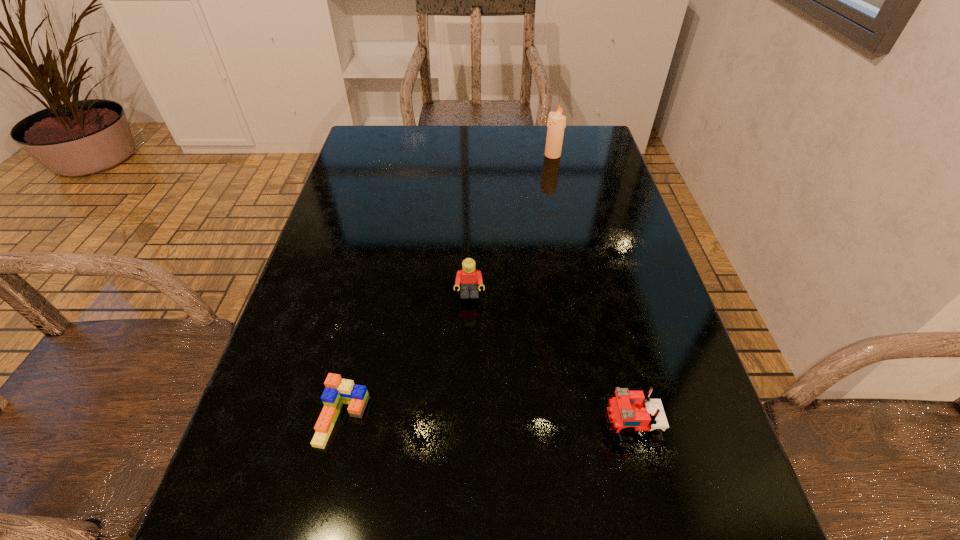
In order to click on vacant region at the right edge of the desktop in this screenshot , I will do `click(587, 280)`.

In the image, there is a desktop. Identify the location of vacant area at the far left corner. The height and width of the screenshot is (540, 960). (383, 162).

In the image, there is a desktop. Where is `blank space at the far right corner`? blank space at the far right corner is located at coordinates (597, 150).

Locate an element on the screen. Image resolution: width=960 pixels, height=540 pixels. vacant area that lies between the tallest object and the shortest object is located at coordinates (447, 287).

The width and height of the screenshot is (960, 540). Find the location of `vacant space in between the second farthest object and the leftmost object`. vacant space in between the second farthest object and the leftmost object is located at coordinates (406, 357).

Identify the location of free spot between the shortest object and the farthest object. The height and width of the screenshot is (540, 960). (447, 287).

You are a GUI agent. You are given a task and a screenshot of the screen. Output one action in this format:
    pyautogui.click(x=<x>, y=<y>)
    Task: Click on the free space between the rightmost Lego and the tallest object
    This screenshot has width=960, height=540.
    Given the screenshot: What is the action you would take?
    pyautogui.click(x=591, y=291)

In order to click on free spot between the third nearest object and the rightmost Lego in this screenshot , I will do `click(550, 361)`.

Identify the location of empty location between the rightmost Lego and the farthest object. Image resolution: width=960 pixels, height=540 pixels. click(591, 291).

I want to click on free space between the leftmost Lego and the rightmost Lego, so pyautogui.click(x=487, y=422).